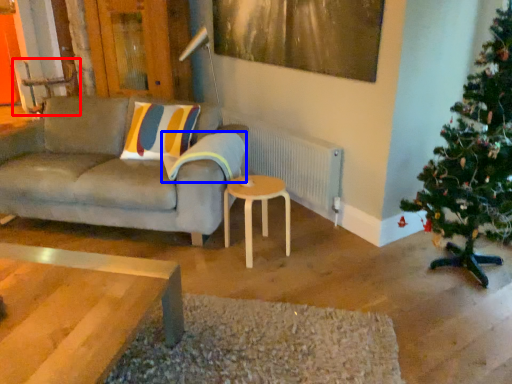
Question: Which point is further to the camera, armchair (highlighted by a red box) or pillow (highlighted by a blue box)?

Choices:
 (A) armchair
 (B) pillow

Answer: (A)